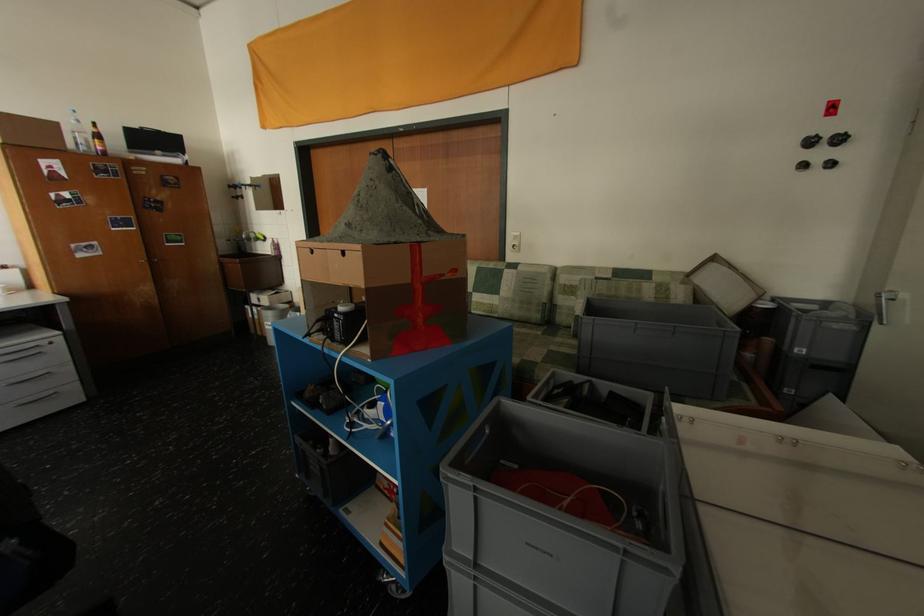
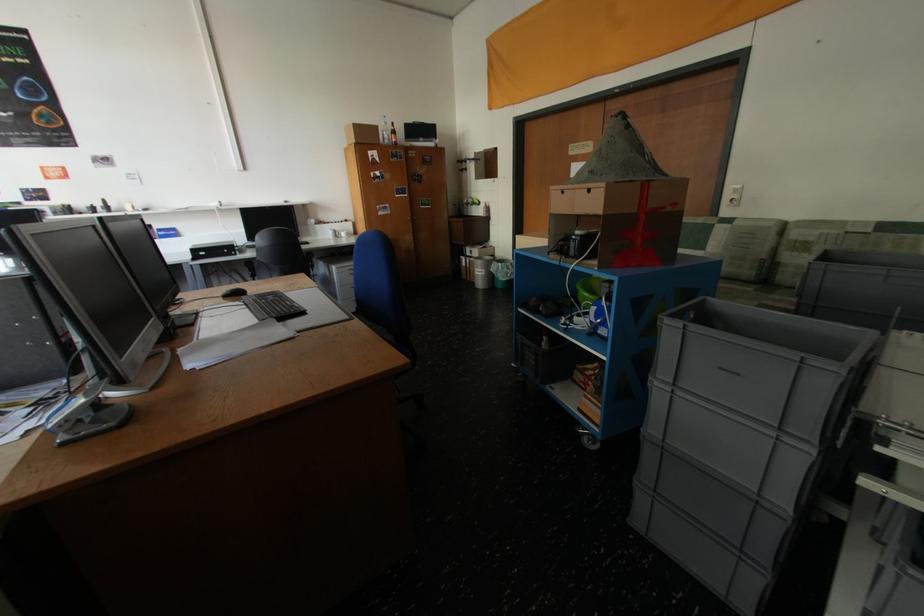
Find the pixel in the second image that matches the point at 191,246 in the first image.

(439, 208)